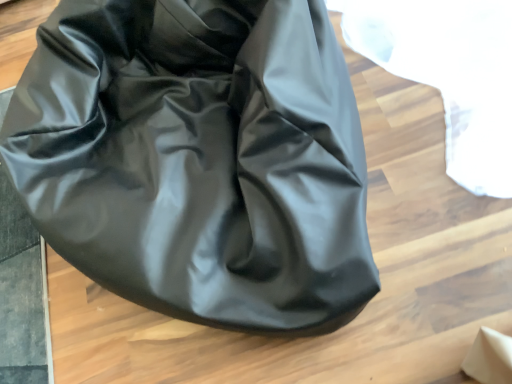
I want to click on glossy black handbag at center, so click(198, 159).

This screenshot has width=512, height=384. What do you see at coordinates (198, 159) in the screenshot? I see `glossy black handbag at center` at bounding box center [198, 159].

Find the location of `glossy black handbag at center`. glossy black handbag at center is located at coordinates (198, 159).